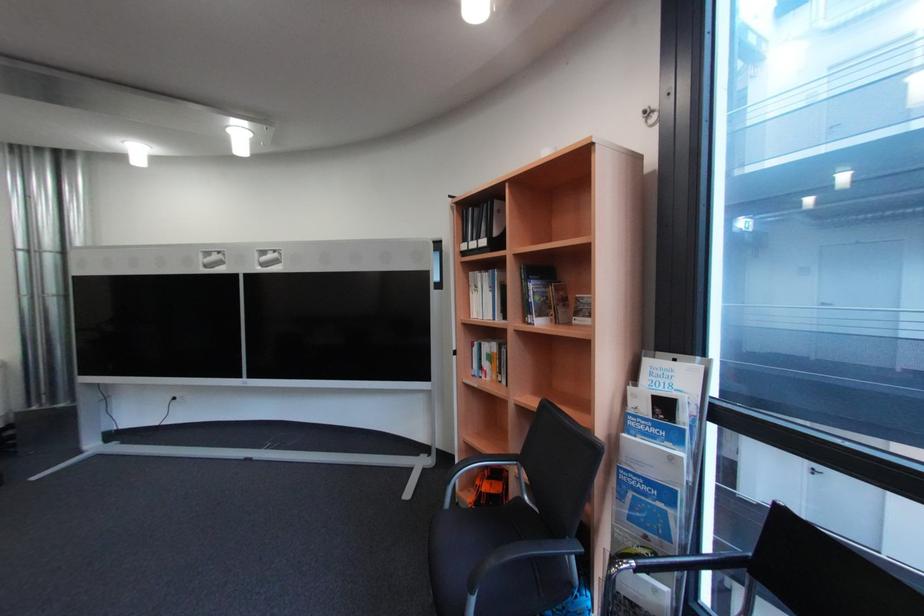
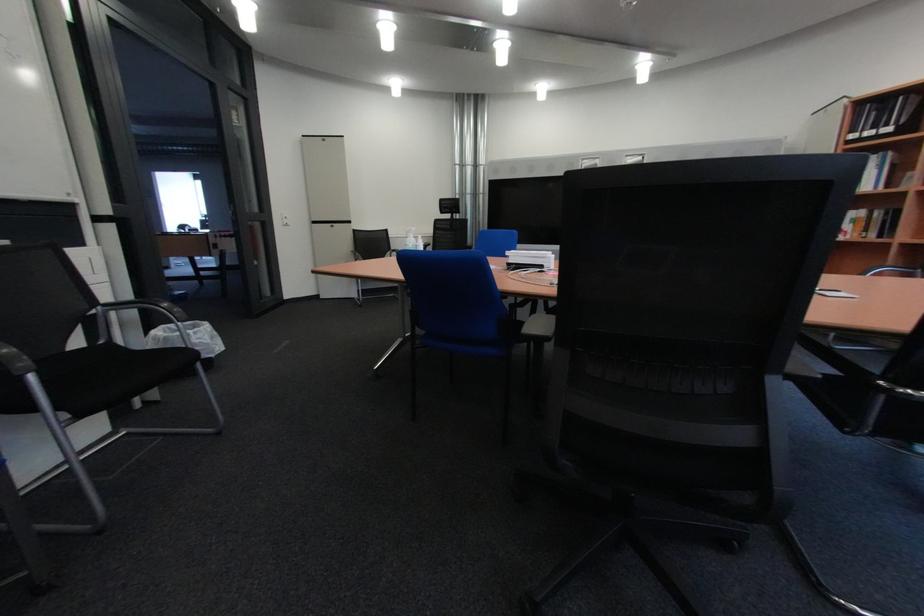
The images are taken continuously from a first-person perspective. In which direction are you moving?

The cameraman moved toward left, backward.